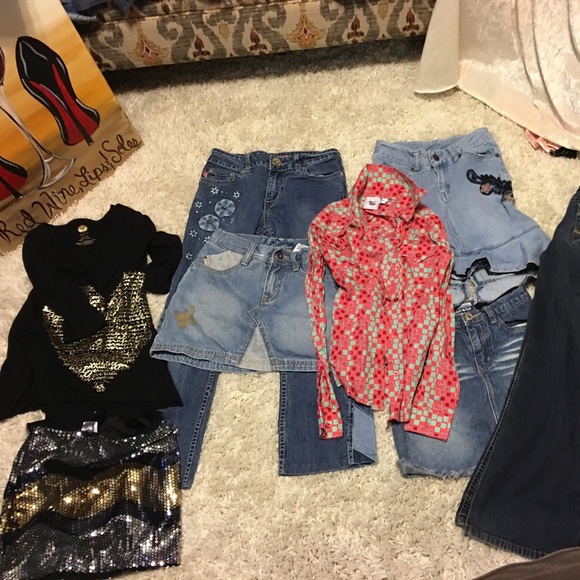
Where is `items of clothing on the floor`? items of clothing on the floor is located at coordinates (104, 507), (97, 339), (190, 377), (233, 297), (378, 340), (461, 191), (477, 379).